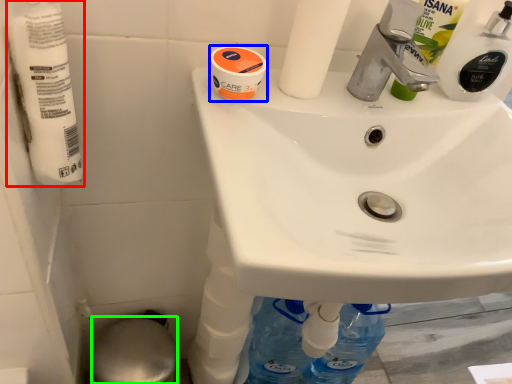
Question: Which object is positioned farthest from toilet paper (highlighted by a red box)? Select from mouthwash (highlighted by a blue box) and bidet (highlighted by a green box).

Choices:
 (A) mouthwash
 (B) bidet

Answer: (B)